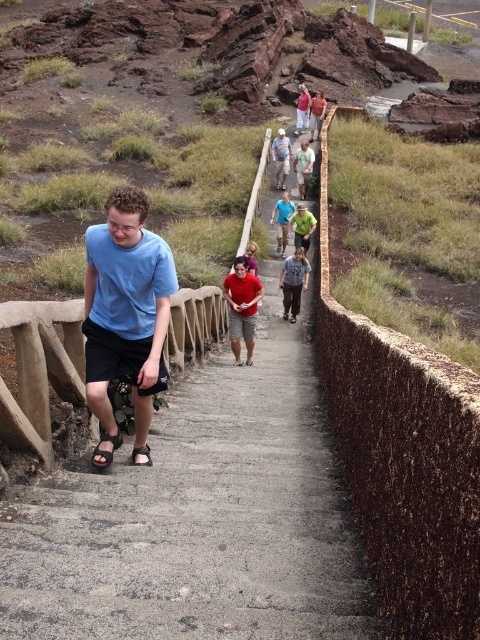
Question: Can you confirm if concrete stairs at center is wider than matte blue t-shirt at center?

Choices:
 (A) no
 (B) yes

Answer: (A)

Question: Is green fabric shirt at center above black leather sandal at lower center?

Choices:
 (A) no
 (B) yes

Answer: (B)

Question: Considering the real-world distances, which object is closest to the blue t-shirt at center?

Choices:
 (A) brown leather sandal at lower left
 (B) black leather sandal at lower center

Answer: (B)

Question: Which of the following is the farthest from the observer?

Choices:
 (A) brown leather sandal at lower left
 (B) matte blue t-shirt at center
 (C) black leather sandal at lower center

Answer: (C)

Question: Can you confirm if concrete stairs at center is positioned to the right of matte blue t-shirt at center?

Choices:
 (A) no
 (B) yes

Answer: (B)

Question: Which object appears farthest from the camera in this image?

Choices:
 (A) matte gray shirt at center
 (B) green matte shirt at center
 (C) matte blue t-shirt at center
 (D) brown leather sandal at lower left

Answer: (A)